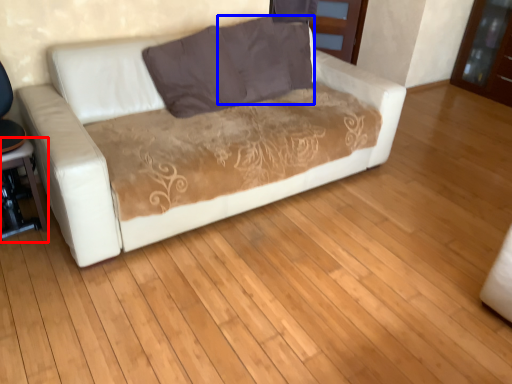
Question: Which object appears closest to the camera in this image, table (highlighted by a red box) or pillow (highlighted by a blue box)?

Choices:
 (A) table
 (B) pillow

Answer: (A)